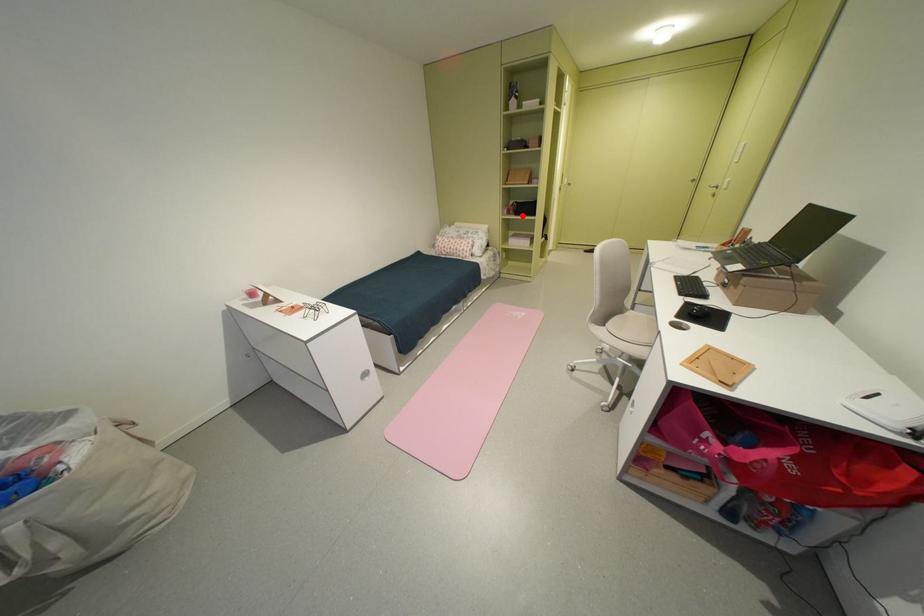
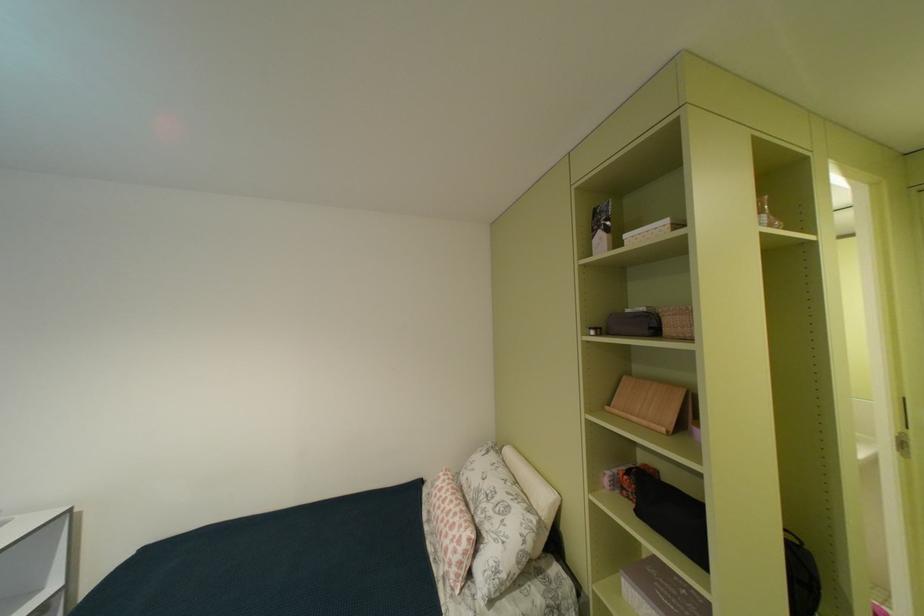
Locate, in the second image, the point that corresponds to the highlighted location in the first image.

(641, 501)